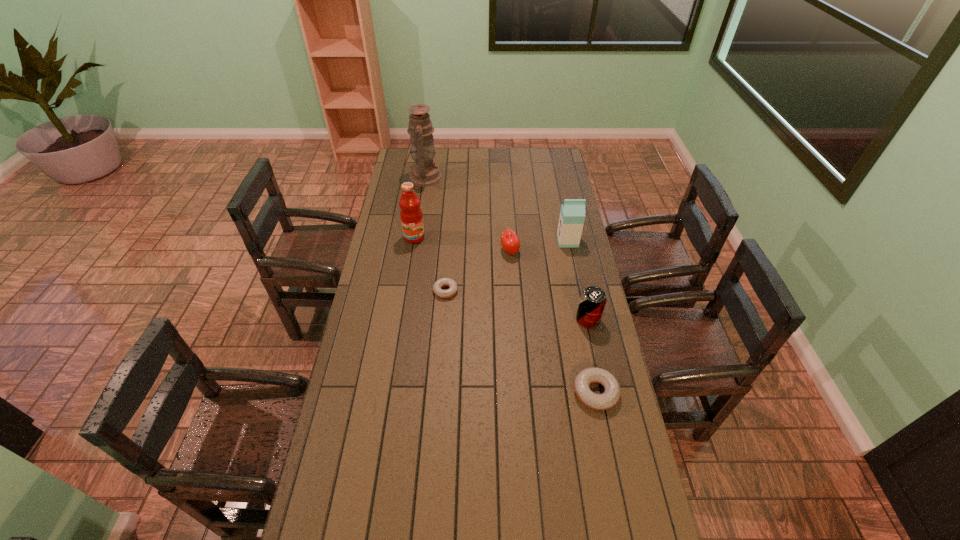
The width and height of the screenshot is (960, 540). In order to click on oil lamp that is positioned at the left edge in this screenshot , I will do `click(424, 173)`.

Where is `fruit juice that is positioned at the left edge`? fruit juice that is positioned at the left edge is located at coordinates (411, 216).

Locate an element on the screen. This screenshot has height=540, width=960. doughnut that is at the right edge is located at coordinates (611, 395).

Locate an element on the screen. soda can located in the right edge section of the desktop is located at coordinates (593, 299).

Identify the location of milk carton at the right edge. This screenshot has width=960, height=540. (572, 215).

At what (x,y) coordinates should I click in order to perform the action: click on object present at the far left corner. Please return your answer as a coordinate pair (x, y). The height and width of the screenshot is (540, 960). Looking at the image, I should click on (424, 173).

Where is `blank space at the far edge of the desktop`? This screenshot has height=540, width=960. blank space at the far edge of the desktop is located at coordinates (527, 168).

In the image, there is a desktop. Identify the location of vacant space at the near edge. (561, 507).

In the image, there is a desktop. Identify the location of vacant space at the left edge. (369, 329).

The image size is (960, 540). What are the coordinates of `vacant space at the right edge of the desktop` in the screenshot? It's located at (559, 309).